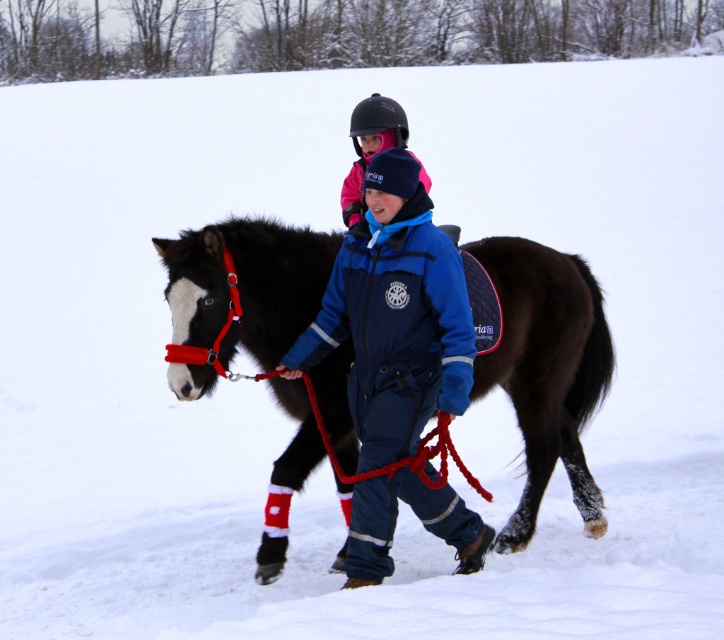
Based on the photo, you are a photographer trying to capture a clear shot of the black glossy horse at center and the pink matte helmet at upper center. Which object should you focus on first if you want to ensure both are in focus, considering their sizes?

The black glossy horse at center is larger than the pink matte helmet at upper center, so focusing on the horse first would help ensure both are in focus since it is the primary subject and occupies more of the frame.

You are a delivery robot with a width of 0.8 meters. You need to pass between the black glossy horse at center and the pink matte helmet at upper center. Can you fit through the space between them?

The distance between the black glossy horse at center and the pink matte helmet at upper center is 1.12 meters. Since your width is 0.8 meters, you can fit through the space as it is wider than your robot.